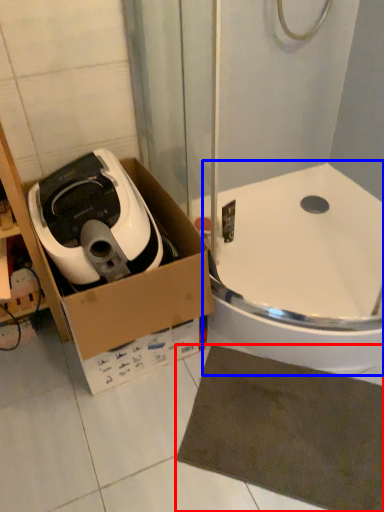
Question: Among these objects, which one is nearest to the camera, bath mat (highlighted by a red box) or bath (highlighted by a blue box)?

Choices:
 (A) bath mat
 (B) bath

Answer: (A)